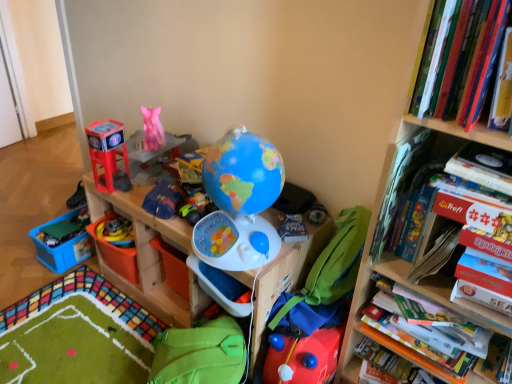
Find the location of a particular element. This screenshot has width=512, height=384. hardcover book at upper right, marked as the second book in a bottom-to-top arrangement is located at coordinates (426, 214).

The height and width of the screenshot is (384, 512). Describe the element at coordinates (116, 231) in the screenshot. I see `rubber yellow toy at lower left, arranged as the second toy when viewed from the left` at that location.

Image resolution: width=512 pixels, height=384 pixels. Describe the element at coordinates (304, 345) in the screenshot. I see `rubberized red toy at lower center, marked as the 1th toy in a right-to-left arrangement` at that location.

In order to face green fabric bean bag chair at center, the 2th bean bag chair positioned from the left, should I rotate leftwards or rightwards?

Turn right by 9.922 degrees to look at green fabric bean bag chair at center, the 2th bean bag chair positioned from the left.

The image size is (512, 384). What are the coordinates of `green fabric bean bag at lower center, positioned as the 1th bean bag chair in bottom-to-top order` in the screenshot? It's located at (200, 354).

Considering the positions of points (83, 213) and (112, 205), is point (83, 213) closer to camera compared to point (112, 205)?

That is False.

Where is `shelf on the right of blue plastic storage box at lower left`? shelf on the right of blue plastic storage box at lower left is located at coordinates (147, 256).

How distant is blue plastic storage box at lower left from wooden toy storage at center?

blue plastic storage box at lower left is 13.04 inches away from wooden toy storage at center.

Considering the relative sizes of blue plastic storage box at lower left and wooden toy storage at center in the image provided, is blue plastic storage box at lower left smaller than wooden toy storage at center?

Yes.

Is wooden toy storage at center inside or outside of matte blue fabric bag at center, the 4th toy when ordered from left to right?

wooden toy storage at center cannot be found inside matte blue fabric bag at center, the 4th toy when ordered from left to right.

Is wooden toy storage at center looking in the opposite direction of matte blue fabric bag at center, which appears as the 3th toy when viewed from the right?

That's not correct — wooden toy storage at center is not looking away from matte blue fabric bag at center, which appears as the 3th toy when viewed from the right.

Is wooden toy storage at center positioned behind matte blue fabric bag at center, which is counted as the 5th toy, starting from the bottom?

Yes, it is behind matte blue fabric bag at center, which is counted as the 5th toy, starting from the bottom.

From the image's perspective, which one is positioned higher, wooden toy storage at center or matte blue fabric bag at center, which is counted as the 5th toy, starting from the bottom?

From the image's view, matte blue fabric bag at center, which is counted as the 5th toy, starting from the bottom, is above.

Considering the points (45, 237) and (119, 223), which point is behind, point (45, 237) or point (119, 223)?

The point (45, 237) is farther.

Choose the correct answer: Is green plastic toy at lower left, which appears as the 5th toy when viewed from the top, inside rubber yellow toy at lower left, the fifth toy viewed from the right, or outside it?

green plastic toy at lower left, which appears as the 5th toy when viewed from the top, is outside rubber yellow toy at lower left, the fifth toy viewed from the right.

How different are the orientations of green plastic toy at lower left, acting as the second toy starting from the bottom, and rubber yellow toy at lower left, which ranks as the third toy in bottom-to-top order, in degrees?

The angle between the facing direction of green plastic toy at lower left, acting as the second toy starting from the bottom, and the facing direction of rubber yellow toy at lower left, which ranks as the third toy in bottom-to-top order, is 6.86 degrees.

From the image's perspective, is green plastic toy at lower left, which appears as the 5th toy when viewed from the top, beneath rubber yellow toy at lower left, arranged as the second toy when viewed from the left?

Indeed, from the image's perspective, green plastic toy at lower left, which appears as the 5th toy when viewed from the top, is shown beneath rubber yellow toy at lower left, arranged as the second toy when viewed from the left.

Is matte plastic globe at center, placed as the fifth toy when sorted from left to right, bigger or smaller than rubberized red toy at lower center, which is the 6th toy from top to bottom?

Clearly, matte plastic globe at center, placed as the fifth toy when sorted from left to right, is smaller in size than rubberized red toy at lower center, which is the 6th toy from top to bottom.

Is matte plastic globe at center, the second toy viewed from the right, beside rubberized red toy at lower center, the first toy positioned from the bottom?

matte plastic globe at center, the second toy viewed from the right, and rubberized red toy at lower center, the first toy positioned from the bottom, are not in contact.

How different are the orientations of matte plastic globe at center, the fourth toy in the bottom-to-top sequence, and rubberized red toy at lower center, which is the 6th toy from top to bottom, in degrees?

The angle between the facing direction of matte plastic globe at center, the fourth toy in the bottom-to-top sequence, and the facing direction of rubberized red toy at lower center, which is the 6th toy from top to bottom, is 47.3 degrees.

Considering the relative positions of rubber yellow toy at lower left, which ranks as the third toy in bottom-to-top order, and matte plastic toy at left, which is the 4th toy from right to left, in the image provided, is rubber yellow toy at lower left, which ranks as the third toy in bottom-to-top order, to the left of matte plastic toy at left, which is the 4th toy from right to left, from the viewer's perspective?

Yes, rubber yellow toy at lower left, which ranks as the third toy in bottom-to-top order, is to the left of matte plastic toy at left, which is the 4th toy from right to left.

Choose the correct answer: Is rubber yellow toy at lower left, the fifth toy viewed from the right, inside matte plastic toy at left, acting as the first toy starting from the top, or outside it?

rubber yellow toy at lower left, the fifth toy viewed from the right, cannot be found inside matte plastic toy at left, acting as the first toy starting from the top.

You are a GUI agent. You are given a task and a screenshot of the screen. Output one action in this format:
    pyautogui.click(x=<x>, y=<y>)
    Task: Click on the 1st toy to the left of the matte plastic toy at left, the 6th toy from the bottom, starting your count from the anchor
    This screenshot has height=384, width=512.
    Given the screenshot: What is the action you would take?
    pyautogui.click(x=116, y=231)

Considering the sizes of rubber yellow toy at lower left, which is counted as the fourth toy, starting from the top, and matte plastic toy at left, which is the 4th toy from right to left, in the image, is rubber yellow toy at lower left, which is counted as the fourth toy, starting from the top, wider or thinner than matte plastic toy at left, which is the 4th toy from right to left,?

Clearly, rubber yellow toy at lower left, which is counted as the fourth toy, starting from the top, has more width compared to matte plastic toy at left, which is the 4th toy from right to left.

Does green plastic toy at lower left, acting as the second toy starting from the bottom, come behind rubberized red toy at lower center, the first toy positioned from the bottom?

Yes, green plastic toy at lower left, acting as the second toy starting from the bottom, is further from the camera.

Does point (55, 244) appear closer or farther from the camera than point (268, 354)?

Point (55, 244) is positioned farther from the camera compared to point (268, 354).

Is green plastic toy at lower left, which appears as the first toy when viewed from the left, taller or shorter than rubberized red toy at lower center, the first toy positioned from the bottom?

green plastic toy at lower left, which appears as the first toy when viewed from the left, is shorter than rubberized red toy at lower center, the first toy positioned from the bottom.

From a real-world perspective, relative to rubberized red toy at lower center, which is the 6th toy from top to bottom, is green plastic toy at lower left, acting as the second toy starting from the bottom, vertically above or below?

Clearly, from a real-world perspective, green plastic toy at lower left, acting as the second toy starting from the bottom, is below rubberized red toy at lower center, which is the 6th toy from top to bottom.

Who is shorter, green fabric bean bag chair at center, the 2th bean bag chair positioned from the left, or hardcover book at right?

hardcover book at right.

Which object is positioned more to the left, green fabric bean bag chair at center, which appears as the first bean bag chair when viewed from the top, or hardcover book at right?

From the viewer's perspective, green fabric bean bag chair at center, which appears as the first bean bag chair when viewed from the top, appears more on the left side.

Is green fabric bean bag chair at center, arranged as the second bean bag chair when ordered from the bottom, oriented towards hardcover book at right?

No, green fabric bean bag chair at center, arranged as the second bean bag chair when ordered from the bottom, is not facing towards hardcover book at right.

This screenshot has height=384, width=512. I want to click on paperback book lying in front of the green fabric bean bag chair at center, arranged as the second bean bag chair when ordered from the bottom, so click(x=485, y=274).

Locate an element on the screen. The height and width of the screenshot is (384, 512). storage box lying above the wooden toy storage at center (from the image's perspective) is located at coordinates (64, 240).

In the image, there is a matte blue fabric bag at center, which is the 2th toy from top to bottom. Find the location of `shelf below it (from the image's perspective)`. shelf below it (from the image's perspective) is located at coordinates (147, 256).

Which object lies further to the anchor point white glossy board game at right, which is the third book from top to bottom, wooden bookcase at right or rubberized red toy at lower center, marked as the 1th toy in a right-to-left arrangement?

rubberized red toy at lower center, marked as the 1th toy in a right-to-left arrangement, is positioned further to the anchor white glossy board game at right, which is the third book from top to bottom.

Based on their spatial positions, is matte blue fabric bag at center, which appears as the 3th toy when viewed from the right, or blue plastic storage box at lower left further from matte plastic globe at center, the second toy viewed from the right?

blue plastic storage box at lower left is positioned further to the anchor matte plastic globe at center, the second toy viewed from the right.

From the image, which object appears to be farther from rubber yellow toy at lower left, arranged as the second toy when viewed from the left, hardcover book at right or blue plastic globe at center?

Based on the image, hardcover book at right appears to be further to rubber yellow toy at lower left, arranged as the second toy when viewed from the left.

When comparing their distances from hardcover book at upper right, marked as the second book in a bottom-to-top arrangement, does green fabric bean bag at lower center, the 2th bean bag chair when ordered from top to bottom, or rubberized red toy at lower center, marked as the 1th toy in a right-to-left arrangement, seem further?

green fabric bean bag at lower center, the 2th bean bag chair when ordered from top to bottom, is further to hardcover book at upper right, marked as the second book in a bottom-to-top arrangement.

From the image, which object appears to be farther from matte plastic globe at center, placed as the fifth toy when sorted from left to right, hardcover book at right or blue plastic storage box at lower left?

blue plastic storage box at lower left is positioned further to the anchor matte plastic globe at center, placed as the fifth toy when sorted from left to right.

Estimate the real-world distances between objects in this image. Which object is further from matte blue fabric bag at center, which is counted as the 5th toy, starting from the bottom, white glossy board game at right, which is the third book from top to bottom, or matte plastic toy at left, which is the 4th toy from right to left?

white glossy board game at right, which is the third book from top to bottom, is positioned further to the anchor matte blue fabric bag at center, which is counted as the 5th toy, starting from the bottom.

Estimate the real-world distances between objects in this image. Which object is further from white glossy board game at right, which is the third book from top to bottom, wooden toy storage at center or wooden bookcase at right?

wooden toy storage at center is positioned further to the anchor white glossy board game at right, which is the third book from top to bottom.

Considering their positions, is rubber yellow toy at lower left, which ranks as the third toy in bottom-to-top order, positioned closer to green fabric bean bag chair at center, which appears as the first bean bag chair when viewed from the top, than hardcover book at right?

The object closer to green fabric bean bag chair at center, which appears as the first bean bag chair when viewed from the top, is hardcover book at right.

Identify the location of shelf between blue plastic storage box at lower left and green fabric bean bag chair at center, the 2th bean bag chair positioned from the left. (147, 256).

This screenshot has width=512, height=384. In order to click on cabinetry between blue plastic storage box at lower left and hardcover book at right from left to right in this screenshot , I will do `click(150, 256)`.

In order to click on paperback book between wooden bookcase at right and matte plastic globe at center, placed as the fifth toy when sorted from left to right, in the front-back direction in this screenshot , I will do `click(485, 274)`.

You are a GUI agent. You are given a task and a screenshot of the screen. Output one action in this format:
    pyautogui.click(x=<x>, y=<y>)
    Task: Click on the shelf between green plastic toy at lower left, which appears as the 5th toy when viewed from the top, and white glossy board game at right, which is the third book from top to bottom, from left to right
    Image resolution: width=512 pixels, height=384 pixels.
    Given the screenshot: What is the action you would take?
    pyautogui.click(x=147, y=256)